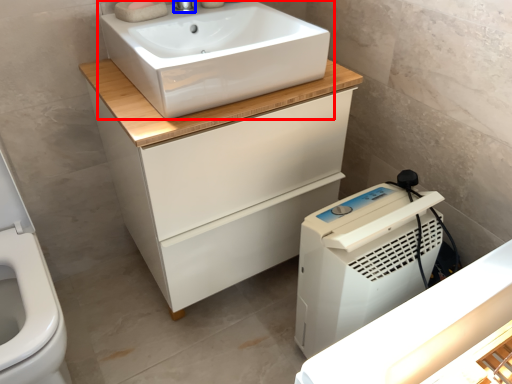
Question: Which of the following is the closest to the observer, sink (highlighted by a red box) or tap (highlighted by a blue box)?

Choices:
 (A) sink
 (B) tap

Answer: (A)